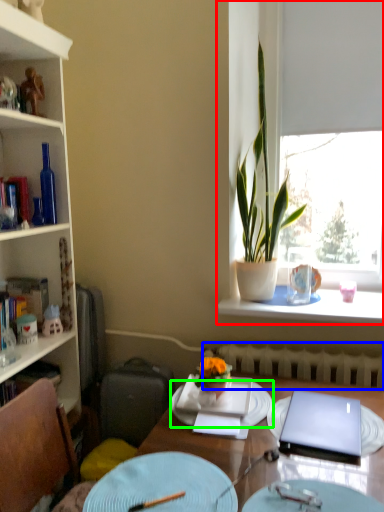
Question: Based on their relative distances, which object is farther from window (highlighted by a red box)? Choose from radiator (highlighted by a blue box) and plate (highlighted by a green box).

Choices:
 (A) radiator
 (B) plate

Answer: (B)